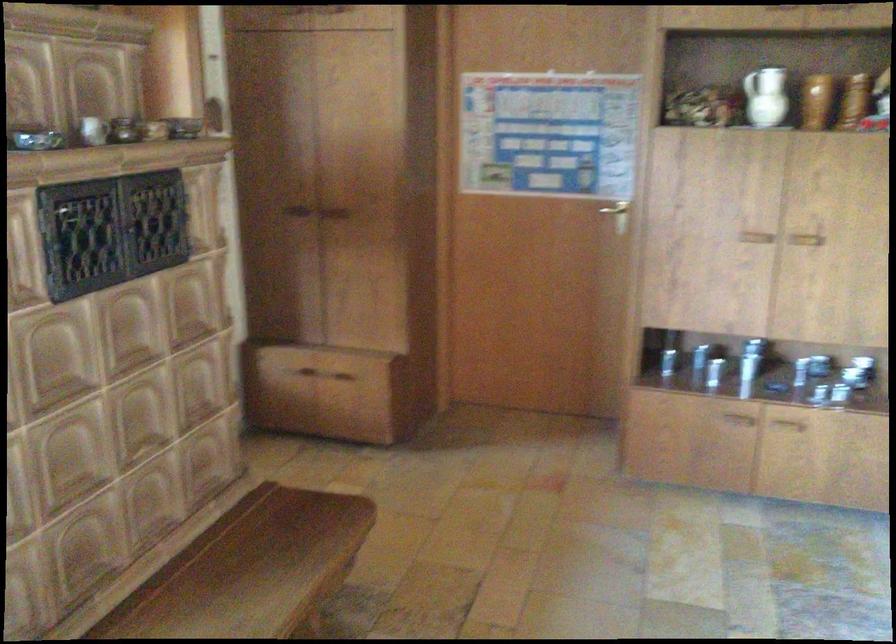
The first image is from the beginning of the video and the second image is from the end. How did the camera likely rotate when shooting the video?

The camera rotated toward left-down.